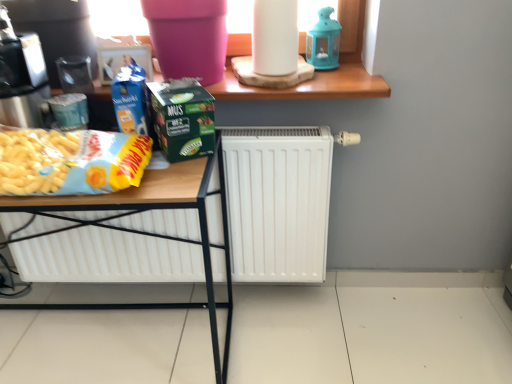
Question: In terms of width, does white matte radiator at center look wider or thinner when compared to matte plastic table at center?

Choices:
 (A) wide
 (B) thin

Answer: (B)

Question: From a real-world perspective, is white matte radiator at center positioned above or below matte plastic table at center?

Choices:
 (A) below
 (B) above

Answer: (B)

Question: Estimate the real-world distances between objects in this image. Which object is farther from the wooden at upper center?

Choices:
 (A) matte plastic table at center
 (B) white matte radiator at center
 (C) green matte carton at center
 (D) white matte paper towel at upper center
 (E) blue glass lantern at upper center

Answer: (A)

Question: Which object is positioned closest to the green matte carton at center?

Choices:
 (A) metallic silver coffee machine at left
 (B) white matte radiator at center
 (C) blue glass lantern at upper center
 (D) matte plastic table at center
 (E) wooden at upper center

Answer: (E)